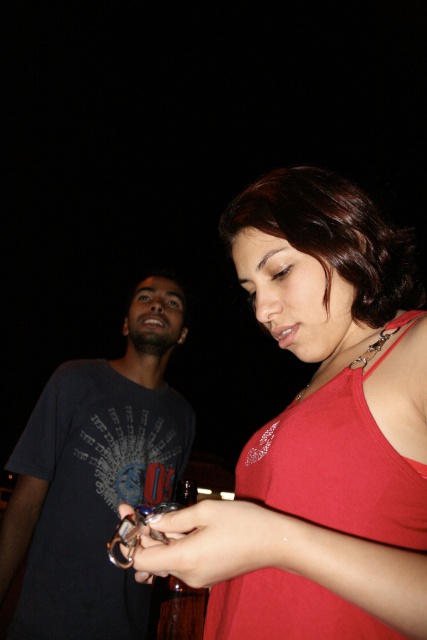
Question: Can you confirm if red matte tank top at center is wider than metallic shiny keychain at center?

Choices:
 (A) yes
 (B) no

Answer: (A)

Question: Considering the relative positions of dark blue t-shirt at left and red matte tank top at center in the image provided, where is dark blue t-shirt at left located with respect to red matte tank top at center?

Choices:
 (A) right
 (B) left

Answer: (B)

Question: Which object appears closest to the camera in this image?

Choices:
 (A) red matte tank top at center
 (B) metallic shiny keychain at center
 (C) dark blue t-shirt at left

Answer: (B)

Question: Which object is closer to the camera taking this photo?

Choices:
 (A) dark blue t-shirt at left
 (B) red matte tank top at center
 (C) metallic shiny keychain at center

Answer: (C)

Question: Which of the following is the closest to the observer?

Choices:
 (A) red matte tank top at center
 (B) dark blue t-shirt at left
 (C) metallic shiny keychain at center

Answer: (C)

Question: Can you confirm if dark blue t-shirt at left is positioned below red matte tank top at center?

Choices:
 (A) yes
 (B) no

Answer: (A)